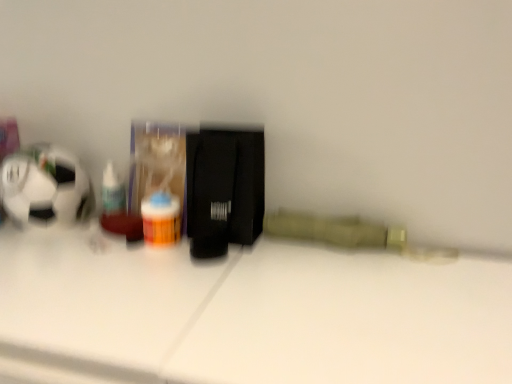
Question: Can you confirm if white glossy table at center is shorter than translucent plastic pill bottle at center?

Choices:
 (A) no
 (B) yes

Answer: (A)

Question: Can you confirm if white glossy table at center is taller than translucent plastic pill bottle at center?

Choices:
 (A) yes
 (B) no

Answer: (A)

Question: Considering the relative sizes of white glossy table at center and translucent plastic pill bottle at center in the image provided, is white glossy table at center bigger than translucent plastic pill bottle at center?

Choices:
 (A) no
 (B) yes

Answer: (B)

Question: Is white glossy table at center oriented towards translucent plastic pill bottle at center?

Choices:
 (A) yes
 (B) no

Answer: (B)

Question: Can you see white glossy table at center touching translucent plastic pill bottle at center?

Choices:
 (A) yes
 (B) no

Answer: (B)

Question: Considering the positions of translucent plastic pill bottle at center and white glossy table at center in the image, is translucent plastic pill bottle at center taller or shorter than white glossy table at center?

Choices:
 (A) short
 (B) tall

Answer: (A)

Question: Is translucent plastic pill bottle at center wider or thinner than white glossy table at center?

Choices:
 (A) thin
 (B) wide

Answer: (A)

Question: Would you say translucent plastic pill bottle at center is inside or outside white glossy table at center?

Choices:
 (A) outside
 (B) inside

Answer: (A)

Question: From the image's perspective, is translucent plastic pill bottle at center located above or below white glossy table at center?

Choices:
 (A) above
 (B) below

Answer: (A)

Question: Looking at their shapes, would you say translucent plastic pill bottle at center is wider or thinner than translucent plastic bottle at left?

Choices:
 (A) thin
 (B) wide

Answer: (B)

Question: From a real-world perspective, relative to translucent plastic bottle at left, is translucent plastic pill bottle at center vertically above or below?

Choices:
 (A) below
 (B) above

Answer: (A)

Question: Is translucent plastic pill bottle at center taller or shorter than translucent plastic bottle at left?

Choices:
 (A) tall
 (B) short

Answer: (B)

Question: In the image, is translucent plastic pill bottle at center positioned in front of or behind translucent plastic bottle at left?

Choices:
 (A) behind
 (B) front

Answer: (B)

Question: Which is correct: white glossy table at center is inside translucent plastic pill bottle at center, or outside of it?

Choices:
 (A) inside
 (B) outside

Answer: (B)

Question: Is white glossy table at center wider or thinner than translucent plastic pill bottle at center?

Choices:
 (A) thin
 (B) wide

Answer: (B)